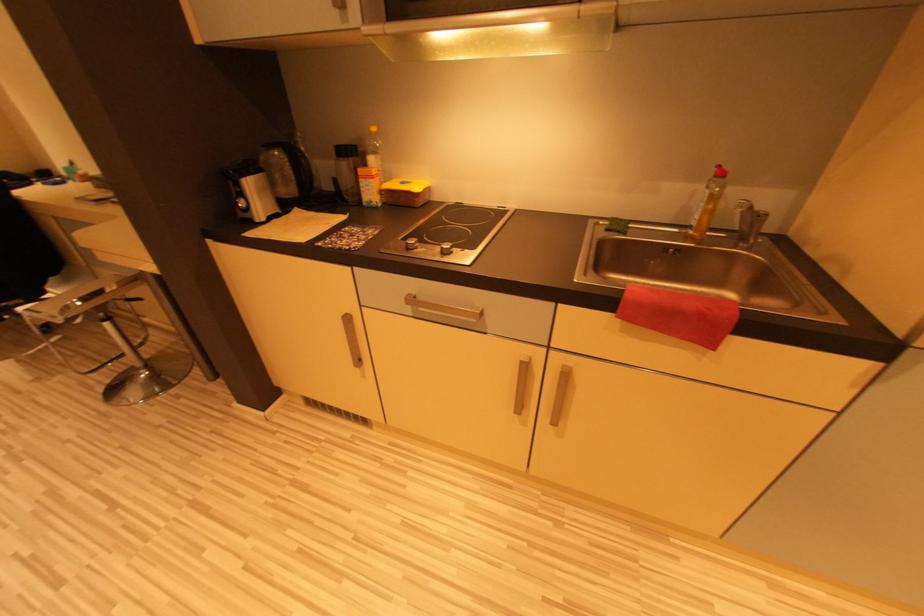
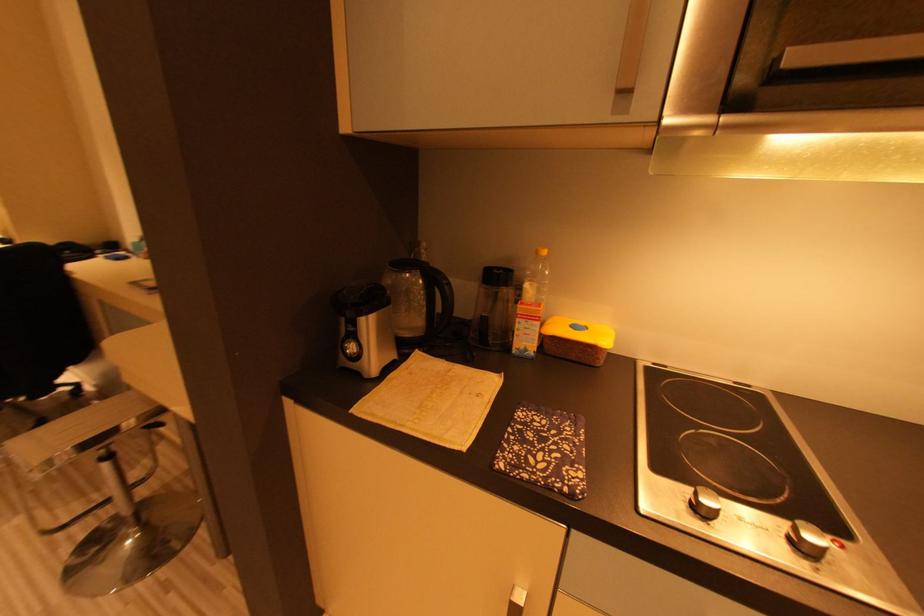
Question: The images are taken continuously from a first-person perspective. In which direction is your viewpoint rotating?

Choices:
 (A) Left
 (B) Right
 (C) Up
 (D) Down

Answer: (C)